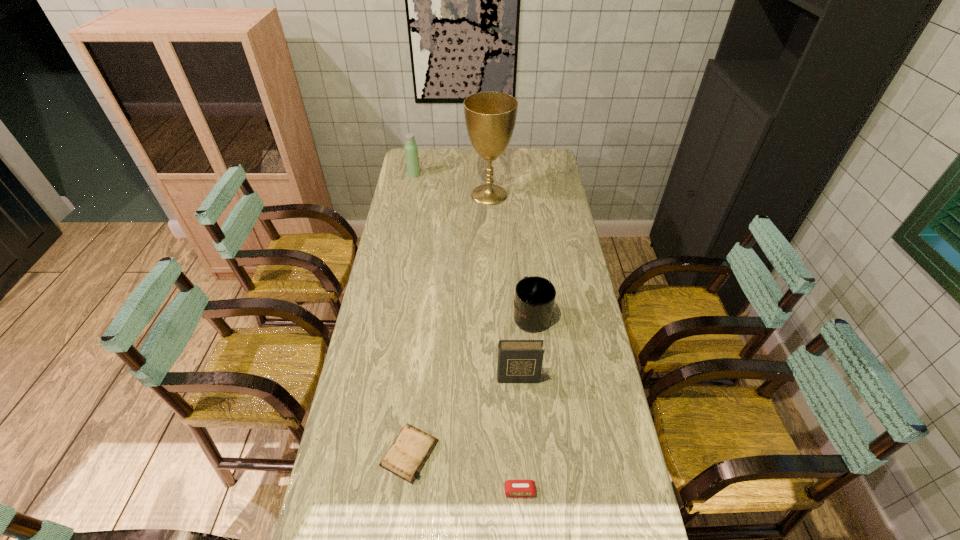
Locate an element on the screen. This screenshot has width=960, height=540. free space between the farther diary and the second farthest object is located at coordinates (503, 286).

Locate an element on the screen. free spot between the tallest object and the leftmost object is located at coordinates (451, 185).

The width and height of the screenshot is (960, 540). What are the coordinates of `vacant region between the farthest object and the fourth nearest object` in the screenshot? It's located at (472, 244).

Where is `vacant space that's between the right diary and the fifth farthest object`? This screenshot has height=540, width=960. vacant space that's between the right diary and the fifth farthest object is located at coordinates (464, 415).

You are a GUI agent. You are given a task and a screenshot of the screen. Output one action in this format:
    pyautogui.click(x=<x>, y=<y>)
    Task: Click on the vacant space in between the alarm clock and the leftmost object
    The image size is (960, 540).
    Given the screenshot: What is the action you would take?
    pyautogui.click(x=467, y=333)

Locate which object ranks fourth in proximity to the nearer diary. Please provide its 2D coordinates. Your answer should be formatted as a tuple, i.e. [(x, y)], where the tuple contains the x and y coordinates of a point satisfying the conditions above.

[(490, 117)]

In order to click on the fourth closest object relative to the fifth nearest object in this screenshot , I will do `click(405, 458)`.